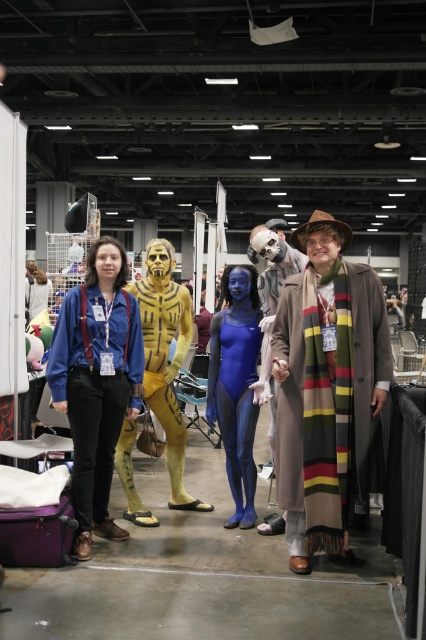
Question: Which point appears closest to the camera in this image?

Choices:
 (A) (296, 252)
 (B) (141, 346)

Answer: (B)

Question: Is matte blue jeans at center smaller than smooth beige coat at center?

Choices:
 (A) yes
 (B) no

Answer: (B)

Question: Which of these objects is positioned farthest from the blue spandex bodysuit at center?

Choices:
 (A) matte blue jeans at center
 (B) yellow matte costume at center
 (C) smooth beige coat at center

Answer: (A)

Question: Which point is closer to the camera taking this photo?

Choices:
 (A) (290, 310)
 (B) (97, 465)
 (C) (265, 301)

Answer: (A)

Question: Can you confirm if matte blue jeans at center is wider than yellow matte costume at center?

Choices:
 (A) yes
 (B) no

Answer: (B)

Question: Is blue spandex bodysuit at center positioned behind smooth beige coat at center?

Choices:
 (A) yes
 (B) no

Answer: (A)